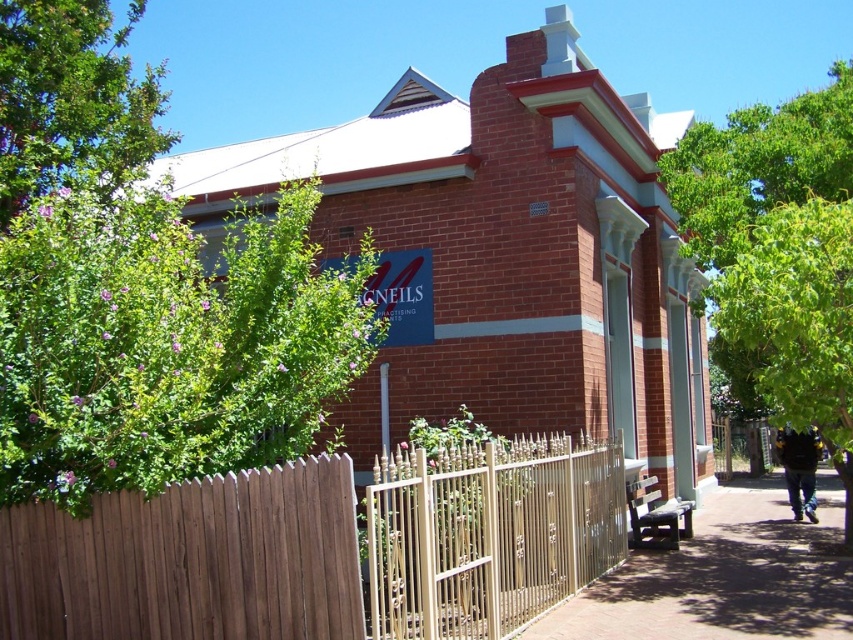
Question: Which object is farther from the camera taking this photo?

Choices:
 (A) gold wrought iron fence at center
 (B) brown wooden fence at lower center

Answer: (A)

Question: Is brown wooden fence at lower center wider than green leafy bush at left?

Choices:
 (A) yes
 (B) no

Answer: (A)

Question: Which object is farther from the camera taking this photo?

Choices:
 (A) brown brick pavement at lower right
 (B) green leafy bush at left

Answer: (A)

Question: Is green leafy tree at right positioned before gold wrought iron fence at center?

Choices:
 (A) yes
 (B) no

Answer: (B)

Question: Does brown wooden fence at lower center have a greater width compared to gold wrought iron fence at center?

Choices:
 (A) no
 (B) yes

Answer: (B)

Question: Which point is farther to the camera?

Choices:
 (A) green leafy tree at right
 (B) green leafy bush at left
 (C) brown wooden fence at lower center

Answer: (A)